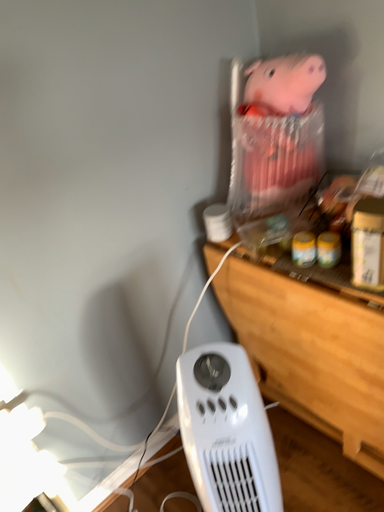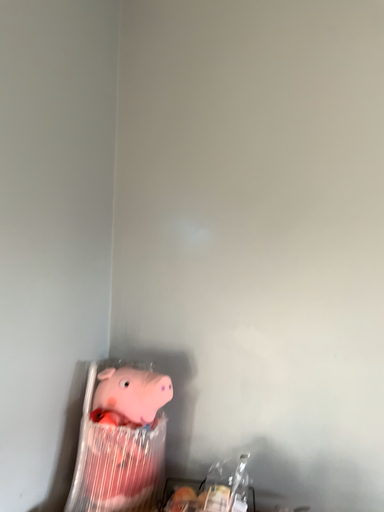
Question: Which way did the camera rotate in the video?

Choices:
 (A) rotated downward
 (B) rotated upward

Answer: (B)